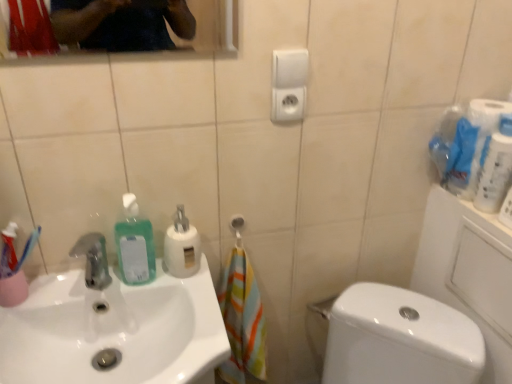
The width and height of the screenshot is (512, 384). I want to click on vacant area on top of white glossy toilet at lower right (from a real-world perspective), so click(402, 315).